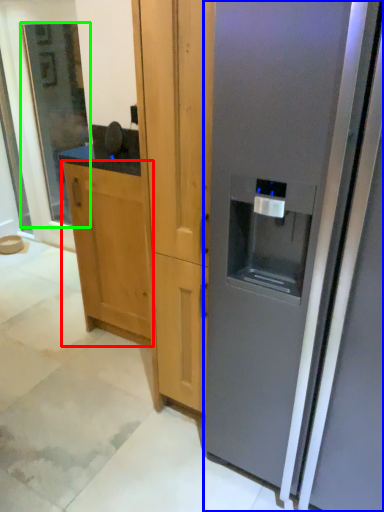
Question: Considering the real-world distances, which object is farthest from cabinetry (highlighted by a red box)? refrigerator (highlighted by a blue box) or glass door (highlighted by a green box)?

Choices:
 (A) refrigerator
 (B) glass door

Answer: (B)